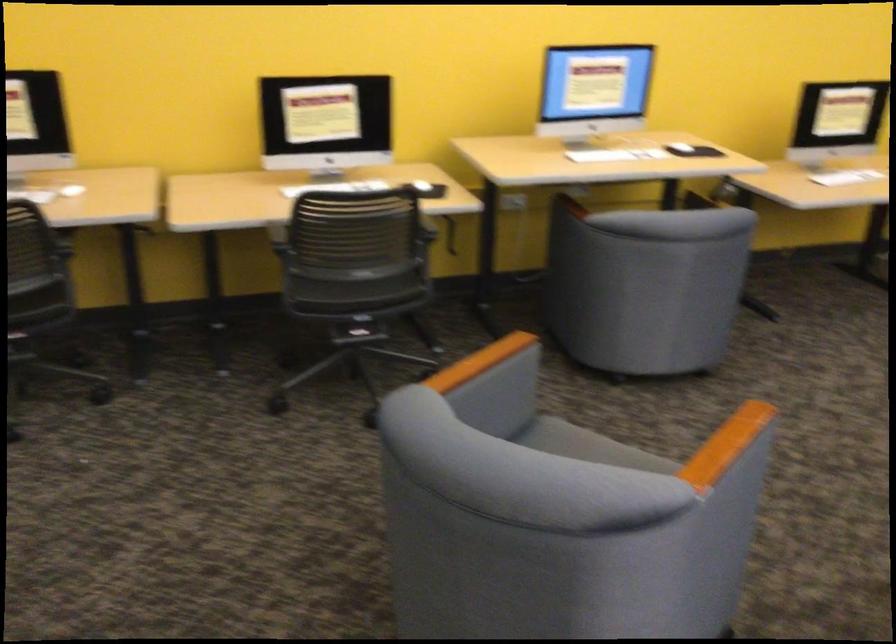
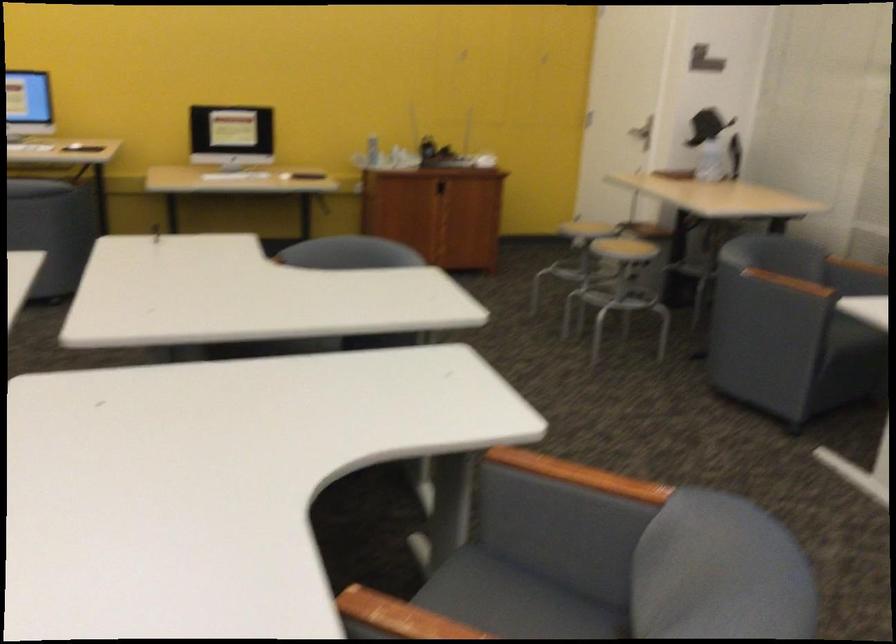
Which direction would the cameraman need to move to produce the second image?

The cameraman walked toward right, backward.